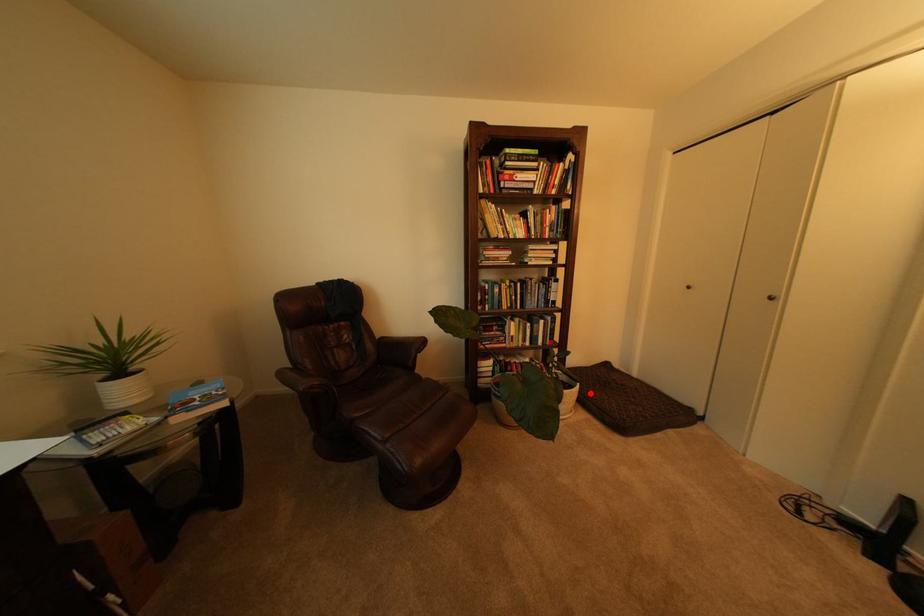
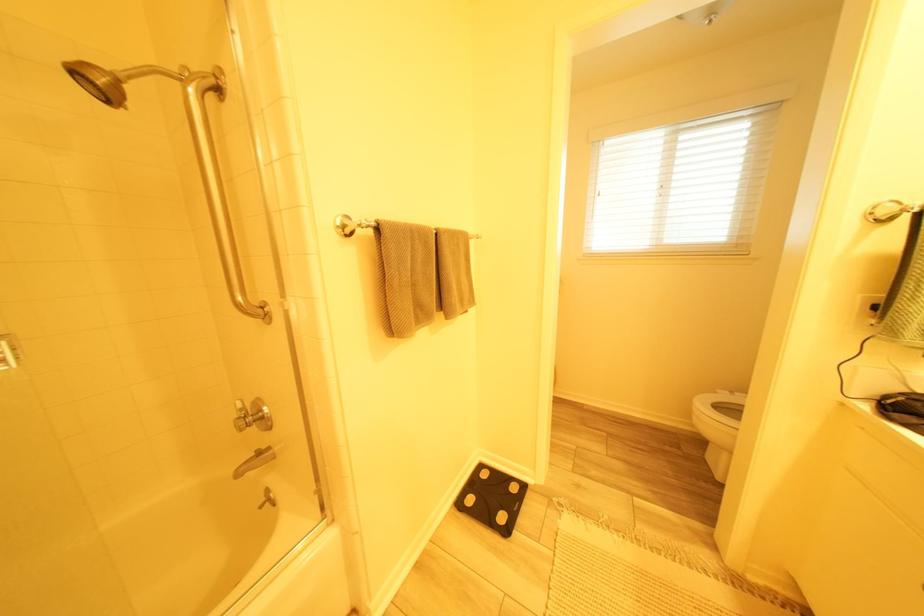
Question: I am providing you with two images of the same scene from different viewpoints. A red point is marked on the first image. Is the red point's position out of view in image 2?

Choices:
 (A) Yes
 (B) No

Answer: (A)